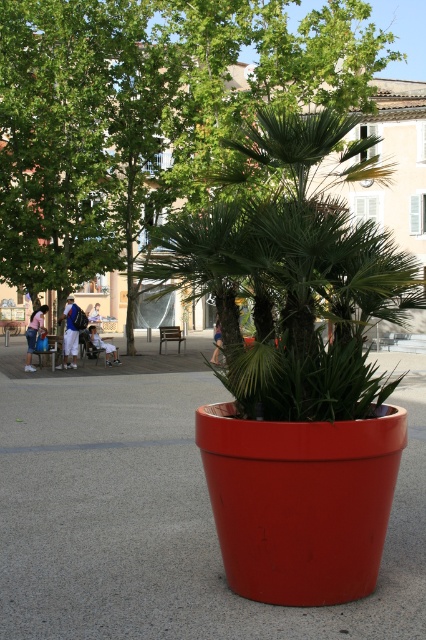
You are standing at the center of the plaza and see the green leafy tree at center. If you walk straight ahead, will you reach the point marked at coordinates (144, 115)?

Yes, because the point (144, 115) corresponds to the green leafy tree at center, so walking straight ahead from the center would lead you directly to that point.

You are a photographer trying to capture a candid shot of the people in the plaza. You notice the white cotton shirt at center and the light blue denim jeans at center. Which clothing item would require you to zoom in more to focus on its details?

The white cotton shirt at center occupies less space than the light blue denim jeans at center, so you would need to zoom in more on the white cotton shirt at center to focus on its details since it is smaller in size.

You are a photographer standing in the public square. You see the denim jacket at left and the light blue denim jeans at center. Which clothing item is higher up in the image?

The denim jacket at left is higher up in the image because it is positioned above the light blue denim jeans at center.